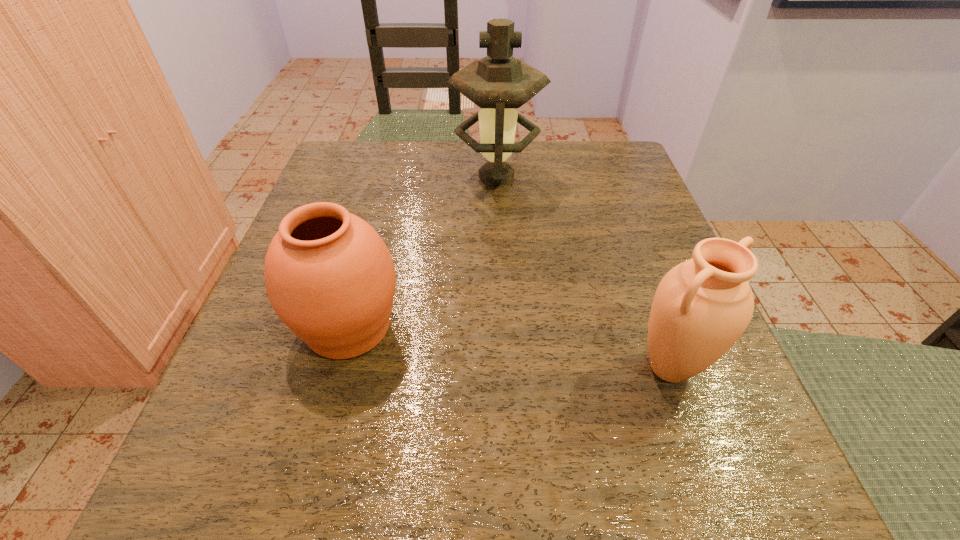
The width and height of the screenshot is (960, 540). Identify the location of the tallest object. (498, 83).

The image size is (960, 540). I want to click on the farthest object, so click(498, 83).

The image size is (960, 540). What are the coordinates of `the right urn` in the screenshot? It's located at (702, 306).

Where is `the left urn`? The image size is (960, 540). the left urn is located at coordinates pyautogui.click(x=330, y=278).

Locate an element on the screen. This screenshot has height=540, width=960. vacant space located 0.060m on the front of the tallest object is located at coordinates (498, 216).

Identify the location of vacant area situated 0.090m on the back of the right urn. (643, 294).

I want to click on blank space located on the left of the leftmost object, so click(262, 327).

Image resolution: width=960 pixels, height=540 pixels. Find the location of `object that is at the far edge`. object that is at the far edge is located at coordinates (498, 83).

The image size is (960, 540). Identify the location of object that is at the left edge. (330, 278).

The image size is (960, 540). Identify the location of object that is at the right edge. (702, 306).